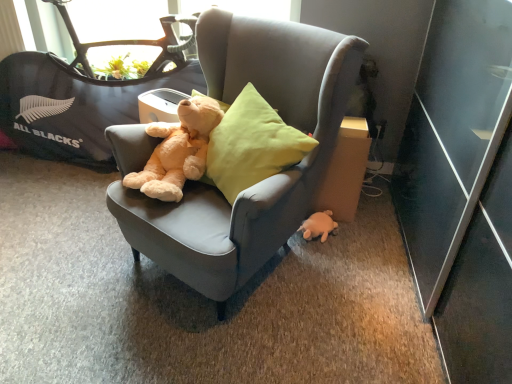
Question: Can you confirm if velvet gray chair at center is taller than black fabric baby carriage at upper left?

Choices:
 (A) no
 (B) yes

Answer: (B)

Question: Does velvet gray chair at center appear on the left side of black fabric baby carriage at upper left?

Choices:
 (A) yes
 (B) no

Answer: (B)

Question: Can you confirm if velvet gray chair at center is thinner than black fabric baby carriage at upper left?

Choices:
 (A) no
 (B) yes

Answer: (A)

Question: Is velvet gray chair at center positioned behind black fabric baby carriage at upper left?

Choices:
 (A) yes
 (B) no

Answer: (B)

Question: Is the depth of velvet gray chair at center less than that of black fabric baby carriage at upper left?

Choices:
 (A) no
 (B) yes

Answer: (B)

Question: From the image's perspective, is velvet gray chair at center on black fabric baby carriage at upper left?

Choices:
 (A) yes
 (B) no

Answer: (B)

Question: Is light brown plush teddy bear at center turned away from velvet gray chair at center?

Choices:
 (A) no
 (B) yes

Answer: (B)

Question: From the image's perspective, does light brown plush teddy bear at center appear higher than velvet gray chair at center?

Choices:
 (A) no
 (B) yes

Answer: (B)

Question: Can you confirm if light brown plush teddy bear at center is shorter than velvet gray chair at center?

Choices:
 (A) no
 (B) yes

Answer: (B)

Question: Is light brown plush teddy bear at center facing towards velvet gray chair at center?

Choices:
 (A) no
 (B) yes

Answer: (B)

Question: Is light brown plush teddy bear at center to the right of velvet gray chair at center from the viewer's perspective?

Choices:
 (A) yes
 (B) no

Answer: (B)

Question: Does light brown plush teddy bear at center contain velvet gray chair at center?

Choices:
 (A) no
 (B) yes

Answer: (A)

Question: Does light brown plush teddy bear at center have a lesser height compared to cardboard at right?

Choices:
 (A) yes
 (B) no

Answer: (A)